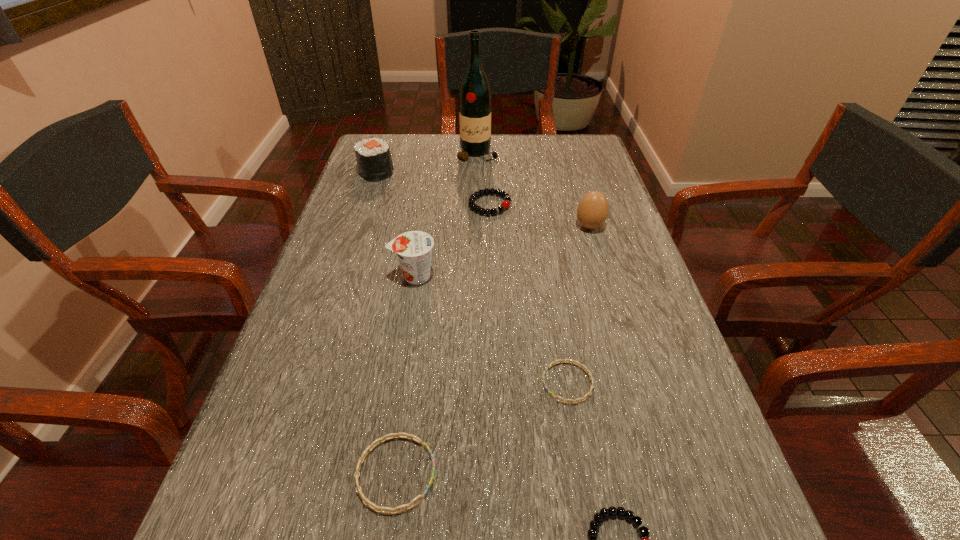
The image size is (960, 540). In order to click on vacant area situated on the surface of the shortest object showing star-shaped elements in this screenshot , I will do `click(413, 383)`.

Identify the location of free location located on the surface of the shortest object showing star-shaped elements. (413, 383).

Identify the location of wine bottle that is at the far edge. This screenshot has height=540, width=960. (475, 95).

Identify the location of sushi that is positioned at the far edge. (373, 156).

This screenshot has height=540, width=960. Find the location of `object at the left edge`. object at the left edge is located at coordinates (373, 156).

Locate an element on the screen. The image size is (960, 540). object that is positioned at the right edge is located at coordinates (592, 211).

Locate an element on the screen. This screenshot has width=960, height=540. object that is at the far left corner is located at coordinates (373, 156).

I want to click on free region at the far edge of the desktop, so tap(448, 158).

Identify the location of vacant area at the left edge. (303, 353).

At what (x,y) coordinates should I click in order to perform the action: click on vacant space at the right edge of the desktop. Please return your answer as a coordinate pair (x, y). This screenshot has width=960, height=540. Looking at the image, I should click on (598, 181).